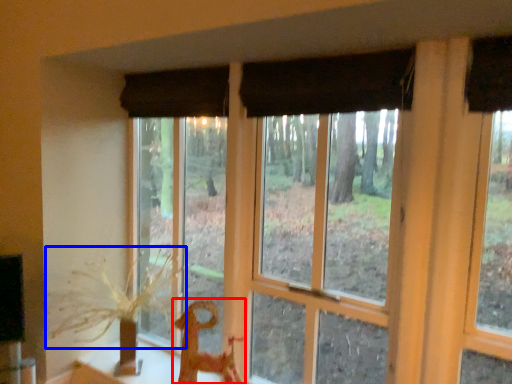
Question: Which object is further to the camera taking this photo, animal (highlighted by a red box) or plant (highlighted by a blue box)?

Choices:
 (A) animal
 (B) plant

Answer: (A)